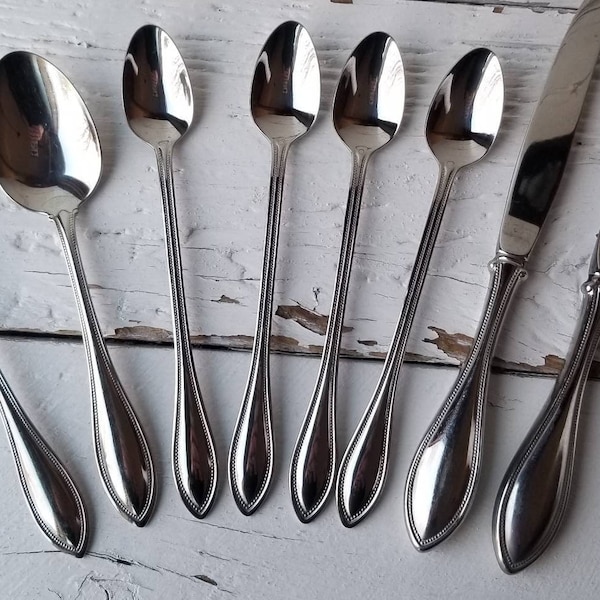
Where is `spoons`? The width and height of the screenshot is (600, 600). spoons is located at coordinates (54, 130), (155, 78), (292, 79), (386, 92), (459, 128).